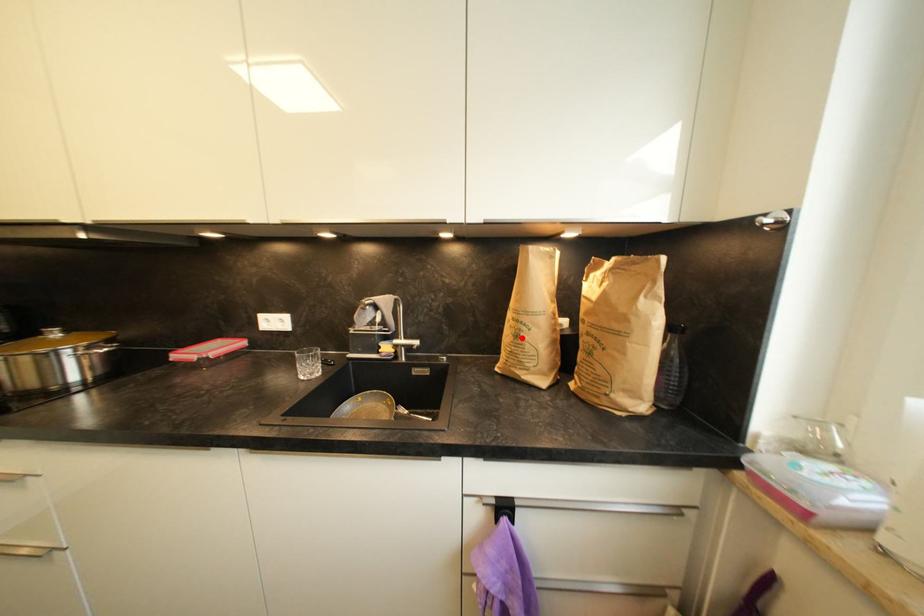
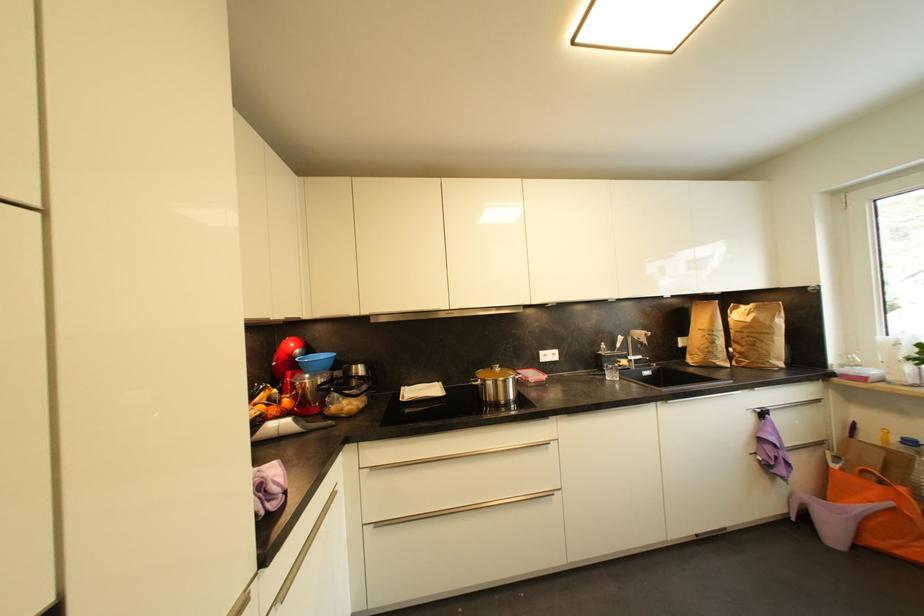
The point at the highlighted location is marked in the first image. Where is the corresponding point in the second image?

(718, 345)